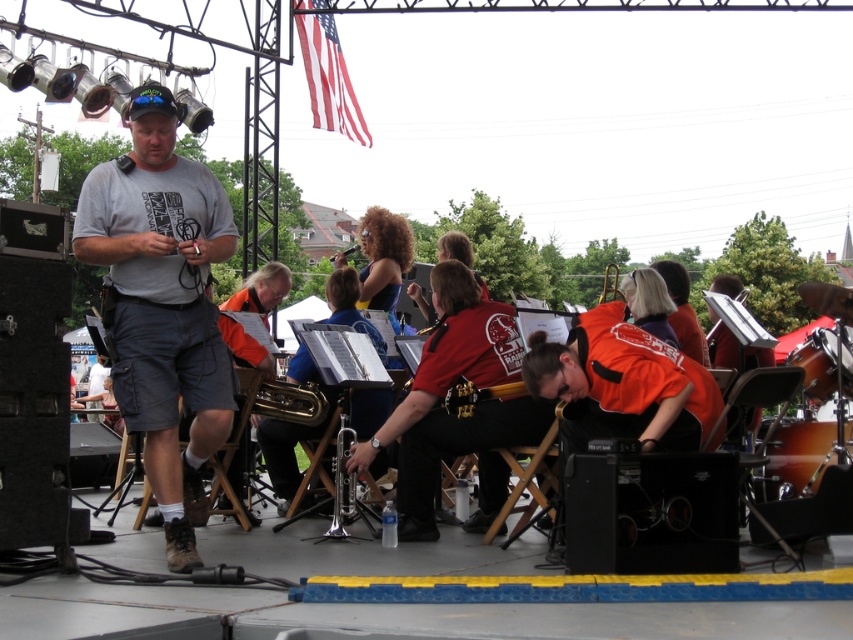
Who is positioned more to the left, wooden drum at right or gold metallic guitar at center?

gold metallic guitar at center is more to the left.

You are a GUI agent. You are given a task and a screenshot of the screen. Output one action in this format:
    pyautogui.click(x=<x>, y=<y>)
    Task: Click on the wooden drum at right
    
    Given the screenshot: What is the action you would take?
    [817, 362]

Image resolution: width=853 pixels, height=640 pixels. In order to click on wooden drum at right in this screenshot , I will do `click(817, 362)`.

Is gray cotton t-shirt at left to the right of brass/yellowish metal trumpet at center from the viewer's perspective?

In fact, gray cotton t-shirt at left is to the left of brass/yellowish metal trumpet at center.

You are a GUI agent. You are given a task and a screenshot of the screen. Output one action in this format:
    pyautogui.click(x=<x>, y=<y>)
    Task: Click on the gray cotton t-shirt at left
    The height and width of the screenshot is (640, 853).
    Given the screenshot: What is the action you would take?
    pyautogui.click(x=161, y=304)

Can you confirm if wooden drum at right is wider than brass/yellowish metal trumpet at center?

Incorrect, wooden drum at right's width does not surpass brass/yellowish metal trumpet at center's.

Is point (828, 356) closer to camera compared to point (280, 406)?

Yes, point (828, 356) is in front of point (280, 406).

Image resolution: width=853 pixels, height=640 pixels. I want to click on wooden drum at right, so click(817, 362).